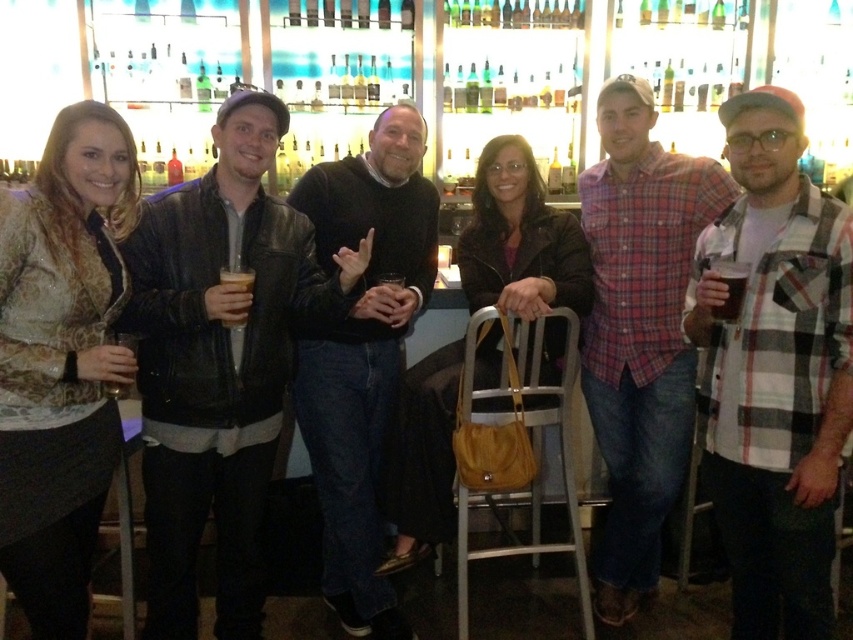
Question: Which object appears farthest from the camera in this image?

Choices:
 (A) plaid shirt at center
 (B) plaid flannel shirt at center
 (C) translucent glass beer at center
 (D) black leather jacket at center

Answer: (A)

Question: Is plaid shirt at center closer to camera compared to translucent glass at left?

Choices:
 (A) no
 (B) yes

Answer: (A)

Question: Among these objects, which one is nearest to the camera?

Choices:
 (A) plaid shirt at center
 (B) plaid flannel shirt at center
 (C) black leather jacket at center

Answer: (B)

Question: From the image, what is the correct spatial relationship of black leather jacket at center in relation to dark brown glass at right?

Choices:
 (A) right
 (B) left

Answer: (B)

Question: Which point is closer to the camera?

Choices:
 (A) dark brown glass at right
 (B) plaid flannel shirt at center

Answer: (B)

Question: Is plaid flannel shirt at center behind black leather jacket at center?

Choices:
 (A) no
 (B) yes

Answer: (A)